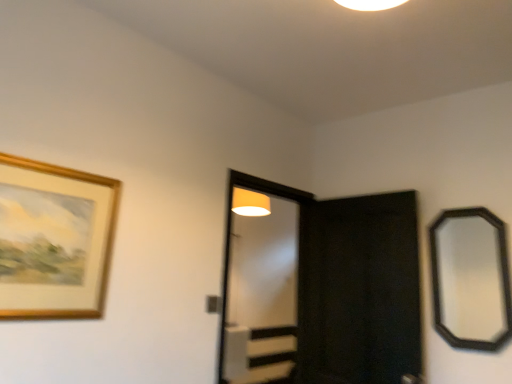
The height and width of the screenshot is (384, 512). Describe the element at coordinates (56, 239) in the screenshot. I see `gold wooden picture frame at upper left` at that location.

In order to click on clear glass screen door at center, which is counted as the 2th screen door, starting from the right in this screenshot , I will do `click(260, 282)`.

You are a GUI agent. You are given a task and a screenshot of the screen. Output one action in this format:
    pyautogui.click(x=<x>, y=<y>)
    Task: Click on the gold wooden picture frame at upper left
    This screenshot has height=384, width=512.
    Given the screenshot: What is the action you would take?
    pyautogui.click(x=56, y=239)

From the image's perspective, is gold wooden picture frame at upper left located beneath black matte screen door at center, marked as the second screen door in a left-to-right arrangement?

Actually, gold wooden picture frame at upper left appears above black matte screen door at center, marked as the second screen door in a left-to-right arrangement, in the image.

In the scene shown: Is gold wooden picture frame at upper left oriented away from black matte screen door at center, marked as the second screen door in a left-to-right arrangement?

No, gold wooden picture frame at upper left is not facing the opposite direction of black matte screen door at center, marked as the second screen door in a left-to-right arrangement.

Which is closer, (31,213) or (392,375)?

The point (31,213) is closer.

Are gold wooden picture frame at upper left and black matte screen door at center, marked as the second screen door in a left-to-right arrangement, located far from each other?

gold wooden picture frame at upper left is far away from black matte screen door at center, marked as the second screen door in a left-to-right arrangement.

Looking at their sizes, would you say gold wooden picture frame at upper left is wider or thinner than black wooden mirror at right?

Clearly, gold wooden picture frame at upper left has less width compared to black wooden mirror at right.

Is gold wooden picture frame at upper left placed right next to black wooden mirror at right?

No, gold wooden picture frame at upper left is not next to black wooden mirror at right.

From the image's perspective, would you say gold wooden picture frame at upper left is shown under black wooden mirror at right?

No, from the image's perspective, gold wooden picture frame at upper left is not below black wooden mirror at right.

Is gold wooden picture frame at upper left taller or shorter than black wooden mirror at right?

In the image, gold wooden picture frame at upper left appears to be shorter than black wooden mirror at right.

Considering the relative sizes of black wooden mirror at right and clear glass screen door at center, which is counted as the 2th screen door, starting from the right, in the image provided, is black wooden mirror at right shorter than clear glass screen door at center, which is counted as the 2th screen door, starting from the right,?

Correct, black wooden mirror at right is not as tall as clear glass screen door at center, which is counted as the 2th screen door, starting from the right.

From the image's perspective, between black wooden mirror at right and clear glass screen door at center, which is counted as the 2th screen door, starting from the right, who is located below?

clear glass screen door at center, which is counted as the 2th screen door, starting from the right, appears lower in the image.

From a real-world perspective, is black wooden mirror at right above or below clear glass screen door at center, positioned as the first screen door in left-to-right order?

black wooden mirror at right is above clear glass screen door at center, positioned as the first screen door in left-to-right order.

From the picture: Can you confirm if gold wooden picture frame at upper left is smaller than clear glass screen door at center, positioned as the first screen door in left-to-right order?

Yes.

Between gold wooden picture frame at upper left and clear glass screen door at center, positioned as the first screen door in left-to-right order, which one has smaller width?

gold wooden picture frame at upper left.

Is gold wooden picture frame at upper left situated inside clear glass screen door at center, positioned as the first screen door in left-to-right order, or outside?

gold wooden picture frame at upper left is spatially situated outside clear glass screen door at center, positioned as the first screen door in left-to-right order.

From a real-world perspective, is gold wooden picture frame at upper left positioned above or below clear glass screen door at center, positioned as the first screen door in left-to-right order?

From a real-world perspective, gold wooden picture frame at upper left is physically above clear glass screen door at center, positioned as the first screen door in left-to-right order.

From the image's perspective, is clear glass screen door at center, which is counted as the 2th screen door, starting from the right, beneath black wooden mirror at right?

Correct, clear glass screen door at center, which is counted as the 2th screen door, starting from the right, appears lower than black wooden mirror at right in the image.

Is clear glass screen door at center, positioned as the first screen door in left-to-right order, facing away from black wooden mirror at right?

That's not correct — clear glass screen door at center, positioned as the first screen door in left-to-right order, is not looking away from black wooden mirror at right.

Is point (267, 302) positioned in front of point (451, 224)?

No, it is behind (451, 224).

Does clear glass screen door at center, positioned as the first screen door in left-to-right order, appear on the right side of black wooden mirror at right?

No.

Does black matte screen door at center, marked as the second screen door in a left-to-right arrangement, turn towards gold wooden picture frame at upper left?

Yes, black matte screen door at center, marked as the second screen door in a left-to-right arrangement, is aimed at gold wooden picture frame at upper left.

Considering the sizes of objects black matte screen door at center, placed as the 1th screen door when sorted from right to left, and gold wooden picture frame at upper left in the image provided, who is wider, black matte screen door at center, placed as the 1th screen door when sorted from right to left, or gold wooden picture frame at upper left?

black matte screen door at center, placed as the 1th screen door when sorted from right to left, is wider.

Are black matte screen door at center, placed as the 1th screen door when sorted from right to left, and gold wooden picture frame at upper left making contact?

No, black matte screen door at center, placed as the 1th screen door when sorted from right to left, is not with gold wooden picture frame at upper left.

In the image, is black matte screen door at center, marked as the second screen door in a left-to-right arrangement, on the left side or the right side of gold wooden picture frame at upper left?

black matte screen door at center, marked as the second screen door in a left-to-right arrangement, is positioned on gold wooden picture frame at upper left's right side.

Locate an element on the screen. This screenshot has width=512, height=384. screen door that is the 1st one when counting backward from the black wooden mirror at right is located at coordinates (359, 290).

From a real-world perspective, is black matte screen door at center, placed as the 1th screen door when sorted from right to left, positioned under black wooden mirror at right based on gravity?

Yes, from a real-world perspective, black matte screen door at center, placed as the 1th screen door when sorted from right to left, is below black wooden mirror at right.

How many degrees apart are the facing directions of black matte screen door at center, placed as the 1th screen door when sorted from right to left, and black wooden mirror at right?

The angular difference between black matte screen door at center, placed as the 1th screen door when sorted from right to left, and black wooden mirror at right is 6.12 degrees.

In order to click on picture frame on the left of black matte screen door at center, placed as the 1th screen door when sorted from right to left in this screenshot , I will do `click(56, 239)`.

You are a GUI agent. You are given a task and a screenshot of the screen. Output one action in this format:
    pyautogui.click(x=<x>, y=<y>)
    Task: Click on the mirror below the gold wooden picture frame at upper left (from the image's perspective)
    The width and height of the screenshot is (512, 384).
    Given the screenshot: What is the action you would take?
    pyautogui.click(x=470, y=278)

From the image, which object appears to be farther from black matte screen door at center, marked as the second screen door in a left-to-right arrangement, black wooden mirror at right or clear glass screen door at center, which is counted as the 2th screen door, starting from the right?

Among the two, clear glass screen door at center, which is counted as the 2th screen door, starting from the right, is located further to black matte screen door at center, marked as the second screen door in a left-to-right arrangement.

When comparing their distances from gold wooden picture frame at upper left, does clear glass screen door at center, which is counted as the 2th screen door, starting from the right, or black matte screen door at center, marked as the second screen door in a left-to-right arrangement, seem further?

clear glass screen door at center, which is counted as the 2th screen door, starting from the right.

When comparing their distances from black matte screen door at center, placed as the 1th screen door when sorted from right to left, does clear glass screen door at center, positioned as the first screen door in left-to-right order, or black wooden mirror at right seem closer?

black wooden mirror at right is positioned closer to the anchor black matte screen door at center, placed as the 1th screen door when sorted from right to left.

Estimate the real-world distances between objects in this image. Which object is further from black wooden mirror at right, gold wooden picture frame at upper left or clear glass screen door at center, which is counted as the 2th screen door, starting from the right?

Based on the image, clear glass screen door at center, which is counted as the 2th screen door, starting from the right, appears to be further to black wooden mirror at right.

When comparing their distances from gold wooden picture frame at upper left, does black matte screen door at center, placed as the 1th screen door when sorted from right to left, or clear glass screen door at center, positioned as the first screen door in left-to-right order, seem closer?

Based on the image, black matte screen door at center, placed as the 1th screen door when sorted from right to left, appears to be nearer to gold wooden picture frame at upper left.

Looking at the image, which one is located closer to black wooden mirror at right, gold wooden picture frame at upper left or black matte screen door at center, marked as the second screen door in a left-to-right arrangement?

black matte screen door at center, marked as the second screen door in a left-to-right arrangement, is closer to black wooden mirror at right.

Looking at the image, which one is located further to black matte screen door at center, placed as the 1th screen door when sorted from right to left, clear glass screen door at center, positioned as the first screen door in left-to-right order, or gold wooden picture frame at upper left?

Among the two, gold wooden picture frame at upper left is located further to black matte screen door at center, placed as the 1th screen door when sorted from right to left.

Estimate the real-world distances between objects in this image. Which object is further from black wooden mirror at right, black matte screen door at center, placed as the 1th screen door when sorted from right to left, or gold wooden picture frame at upper left?

gold wooden picture frame at upper left is positioned further to the anchor black wooden mirror at right.

You are a GUI agent. You are given a task and a screenshot of the screen. Output one action in this format:
    pyautogui.click(x=<x>, y=<y>)
    Task: Click on the screen door located between gold wooden picture frame at upper left and black matte screen door at center, marked as the second screen door in a left-to-right arrangement, in the left-right direction
    The image size is (512, 384).
    Given the screenshot: What is the action you would take?
    pyautogui.click(x=260, y=282)

Locate an element on the screen. The width and height of the screenshot is (512, 384). screen door between clear glass screen door at center, which is counted as the 2th screen door, starting from the right, and black wooden mirror at right from left to right is located at coordinates (359, 290).